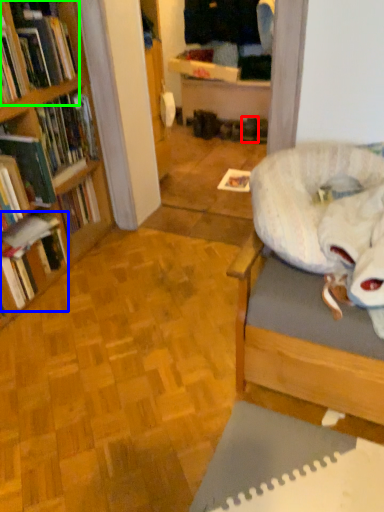
Question: Considering the real-world distances, which object is farthest from footwear (highlighted by a red box)? book (highlighted by a blue box) or book (highlighted by a green box)?

Choices:
 (A) book
 (B) book

Answer: (A)